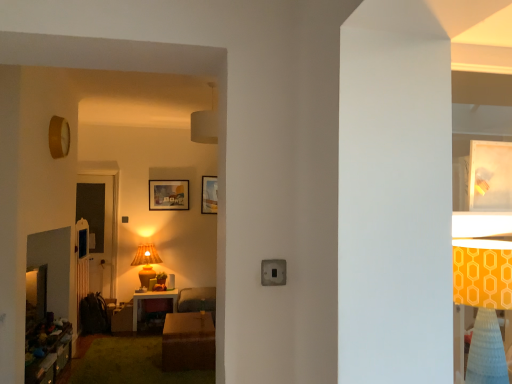
What are the coordinates of `vacant point to the left of brown wooden table at center, the 2th table viewed from the left` in the screenshot? It's located at (126, 356).